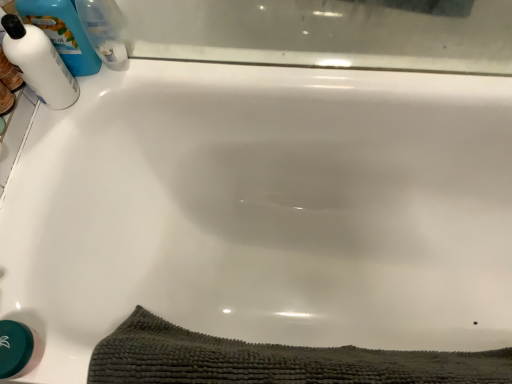
Question: Should I look upward or downward to see blue plastic bottle at upper left, arranged as the third cleaning product when viewed from the left?

Choices:
 (A) down
 (B) up

Answer: (B)

Question: From the image's perspective, would you say white glossy bottle at upper left, which is the 3th cleaning product in right-to-left order, is positioned over dark gray textured bath towel at lower center?

Choices:
 (A) no
 (B) yes

Answer: (B)

Question: Considering the relative sizes of white glossy bottle at upper left, which is the 3th cleaning product in right-to-left order, and dark gray textured bath towel at lower center in the image provided, is white glossy bottle at upper left, which is the 3th cleaning product in right-to-left order, smaller than dark gray textured bath towel at lower center?

Choices:
 (A) no
 (B) yes

Answer: (B)

Question: Considering the relative positions of white glossy bottle at upper left, the 1th cleaning product in the left-to-right sequence, and dark gray textured bath towel at lower center in the image provided, is white glossy bottle at upper left, the 1th cleaning product in the left-to-right sequence, to the left of dark gray textured bath towel at lower center from the viewer's perspective?

Choices:
 (A) yes
 (B) no

Answer: (A)

Question: Does white glossy bottle at upper left, the 1th cleaning product in the left-to-right sequence, have a lesser height compared to dark gray textured bath towel at lower center?

Choices:
 (A) no
 (B) yes

Answer: (B)

Question: From a real-world perspective, is white glossy bottle at upper left, the 1th cleaning product in the left-to-right sequence, over dark gray textured bath towel at lower center?

Choices:
 (A) no
 (B) yes

Answer: (B)

Question: Is white glossy bottle at upper left, the 1th cleaning product in the left-to-right sequence, outside of dark gray textured bath towel at lower center?

Choices:
 (A) no
 (B) yes

Answer: (B)

Question: Is dark gray textured bath towel at lower center facing towards blue plastic bottle at upper left, which is counted as the first cleaning product, starting from the right?

Choices:
 (A) yes
 (B) no

Answer: (B)

Question: Considering the relative sizes of dark gray textured bath towel at lower center and blue plastic bottle at upper left, which is counted as the first cleaning product, starting from the right, in the image provided, is dark gray textured bath towel at lower center thinner than blue plastic bottle at upper left, which is counted as the first cleaning product, starting from the right,?

Choices:
 (A) no
 (B) yes

Answer: (B)

Question: Is dark gray textured bath towel at lower center not inside blue plastic bottle at upper left, arranged as the third cleaning product when viewed from the left?

Choices:
 (A) no
 (B) yes

Answer: (B)

Question: Does dark gray textured bath towel at lower center appear on the right side of blue plastic bottle at upper left, arranged as the third cleaning product when viewed from the left?

Choices:
 (A) no
 (B) yes

Answer: (B)

Question: Can you confirm if dark gray textured bath towel at lower center is bigger than blue plastic bottle at upper left, arranged as the third cleaning product when viewed from the left?

Choices:
 (A) yes
 (B) no

Answer: (A)

Question: Is blue plastic bottle at upper left, which is counted as the first cleaning product, starting from the right, located within dark gray textured bath towel at lower center?

Choices:
 (A) no
 (B) yes

Answer: (A)

Question: Is white glossy bottle at upper left, the 1th cleaning product in the left-to-right sequence, a part of dark gray textured bath towel at lower center?

Choices:
 (A) yes
 (B) no

Answer: (B)